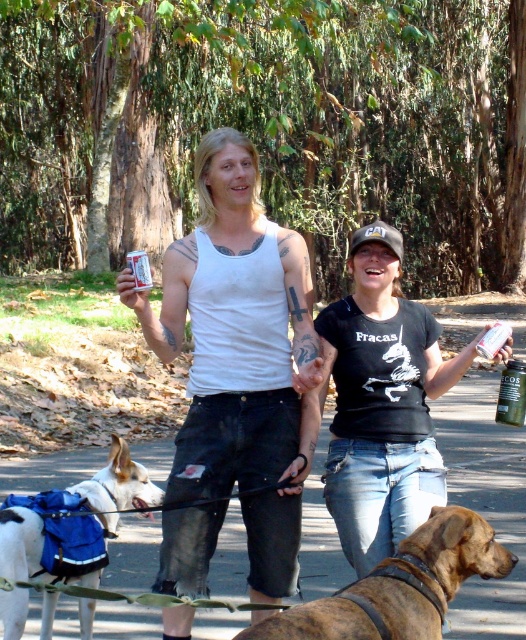
Question: Does black cotton t-shirt at center appear on the left side of green glass bottle at right?

Choices:
 (A) no
 (B) yes

Answer: (B)

Question: Does brindle leather collar at lower center appear on the left side of white plastic can at center?

Choices:
 (A) yes
 (B) no

Answer: (B)

Question: Is white cotton tank top at center positioned in front of white plastic can at center?

Choices:
 (A) no
 (B) yes

Answer: (A)

Question: Estimate the real-world distances between objects in this image. Which object is closer to the brindle leather collar at lower center?

Choices:
 (A) black cotton t-shirt at center
 (B) white plastic can at center
 (C) green glass bottle at right
 (D) white cotton tank top at center

Answer: (A)

Question: Which point is closer to the camera?

Choices:
 (A) brindle leather collar at lower center
 (B) white fabric dog at lower left
 (C) black cotton t-shirt at center
 (D) green glass bottle at right

Answer: (A)

Question: Which point appears closest to the camera in this image?

Choices:
 (A) (x=260, y=368)
 (B) (x=500, y=342)
 (C) (x=151, y=280)

Answer: (B)